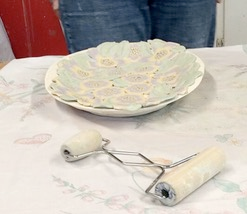
Locate an element on the screen. The height and width of the screenshot is (214, 247). dark vertical line on wall is located at coordinates (223, 22).